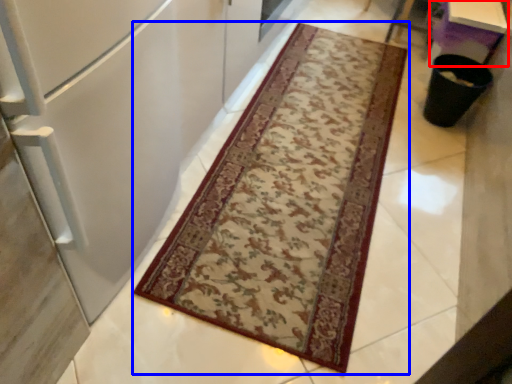
Question: Which object is closer to the camera taking this photo, table (highlighted by a red box) or mat (highlighted by a blue box)?

Choices:
 (A) table
 (B) mat

Answer: (B)